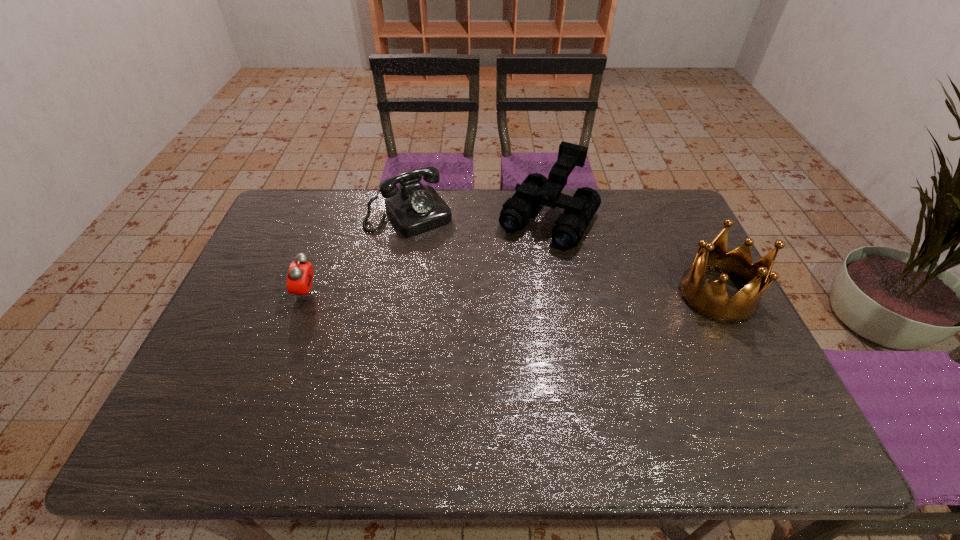
At what (x,y) coordinates should I click in order to perform the action: click on vacant space located on the front lenses of the binoculars. Please return your answer as a coordinate pair (x, y). This screenshot has width=960, height=540. Looking at the image, I should click on (468, 342).

What are the coordinates of `free space located on the front lenses of the binoculars` in the screenshot? It's located at (513, 275).

Locate an element on the screen. This screenshot has height=540, width=960. telephone that is at the far edge is located at coordinates (414, 208).

Where is `binoculars that is at the far edge`? The image size is (960, 540). binoculars that is at the far edge is located at coordinates (536, 189).

Identify the location of object located in the right edge section of the desktop. click(x=711, y=301).

In the image, there is a desktop. Where is `vacant region at the far edge`? Image resolution: width=960 pixels, height=540 pixels. vacant region at the far edge is located at coordinates click(x=455, y=197).

Locate an element on the screen. The height and width of the screenshot is (540, 960). free space at the near edge is located at coordinates [533, 408].

Where is `vacant point at the left edge`? vacant point at the left edge is located at coordinates (263, 244).

This screenshot has height=540, width=960. I want to click on free region at the right edge, so click(727, 350).

The image size is (960, 540). Find the location of `vacant space at the far left corner`. vacant space at the far left corner is located at coordinates (312, 232).